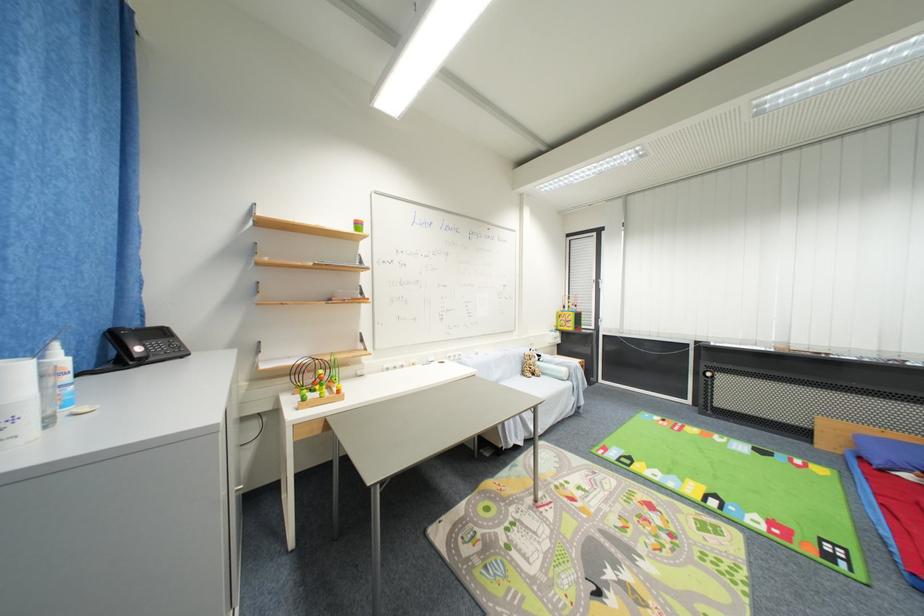
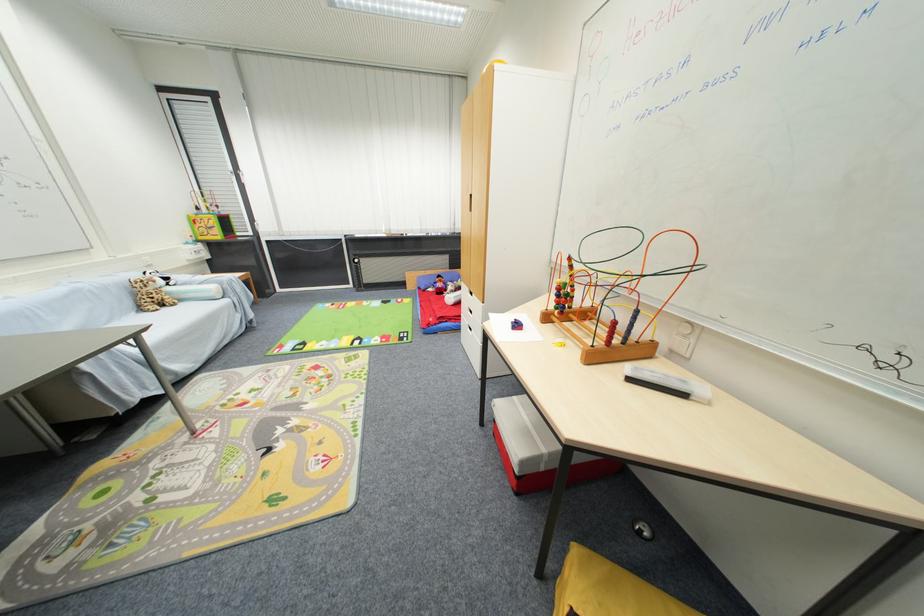
Where in the second image is the point corresponding to point 528,376 from the first image?

(146, 310)